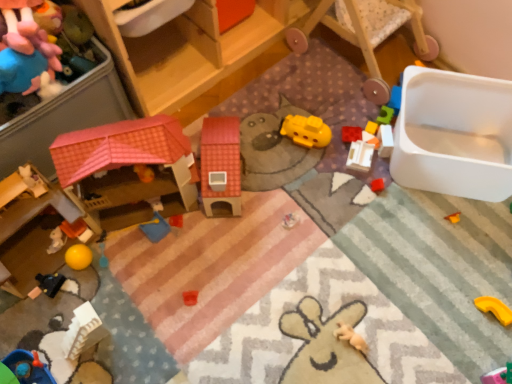
The image size is (512, 384). What are the coordinates of `vacant area to the right of yellow matte submarine at center, the 7th toy when ordered from right to left` in the screenshot? It's located at (357, 126).